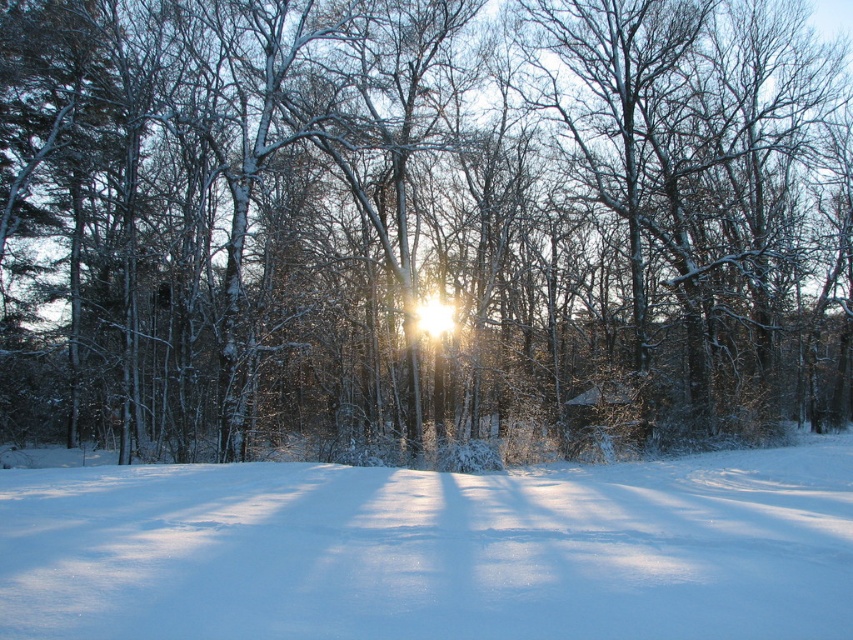
You are standing at the point marked by the coordinate point (421, 225) in the winter forest scene. Looking around, you see a white snow covered tree at center. Can you determine if the tree is directly in front of you or to one side?

The white snow covered tree at center is represented by the point (421, 225), which means you are standing exactly at the location of the tree. Therefore, the tree is not in front or to the side but directly where you are positioned.